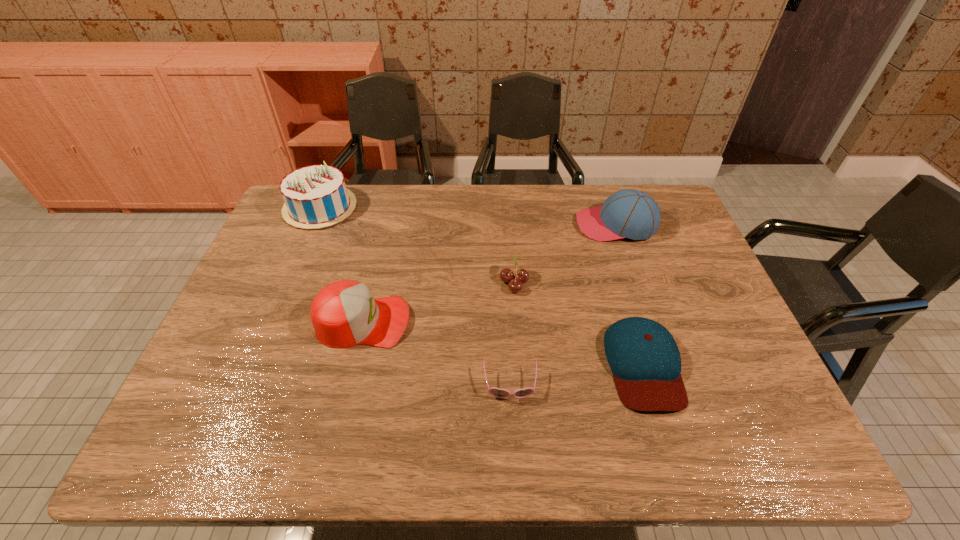
Image resolution: width=960 pixels, height=540 pixels. In order to click on object that is at the far left corner in this screenshot , I will do `click(315, 196)`.

The image size is (960, 540). In order to click on object that is at the far right corner in this screenshot , I will do `click(629, 213)`.

Where is `vacant position at the far edge of the desktop`? vacant position at the far edge of the desktop is located at coordinates (367, 205).

Where is `free space at the near edge of the desktop`? This screenshot has height=540, width=960. free space at the near edge of the desktop is located at coordinates (463, 440).

Find the location of a particular element. free space at the left edge of the desktop is located at coordinates (256, 362).

Identify the location of vacant space at the right edge of the desktop. Image resolution: width=960 pixels, height=540 pixels. (707, 271).

The width and height of the screenshot is (960, 540). Identify the location of free spot at the near left corner of the desktop. (204, 446).

Where is `vacant space in between the birthday cake and the leftmost baseball cap`? The image size is (960, 540). vacant space in between the birthday cake and the leftmost baseball cap is located at coordinates (342, 265).

You are a GUI agent. You are given a task and a screenshot of the screen. Output one action in this format:
    pyautogui.click(x=<x>, y=<y>)
    Task: Click on the free space between the shortest object and the birthday cake
    
    Given the screenshot: What is the action you would take?
    pyautogui.click(x=415, y=296)

Locate an element on the screen. blank region between the shortest object and the birthday cake is located at coordinates (415, 296).